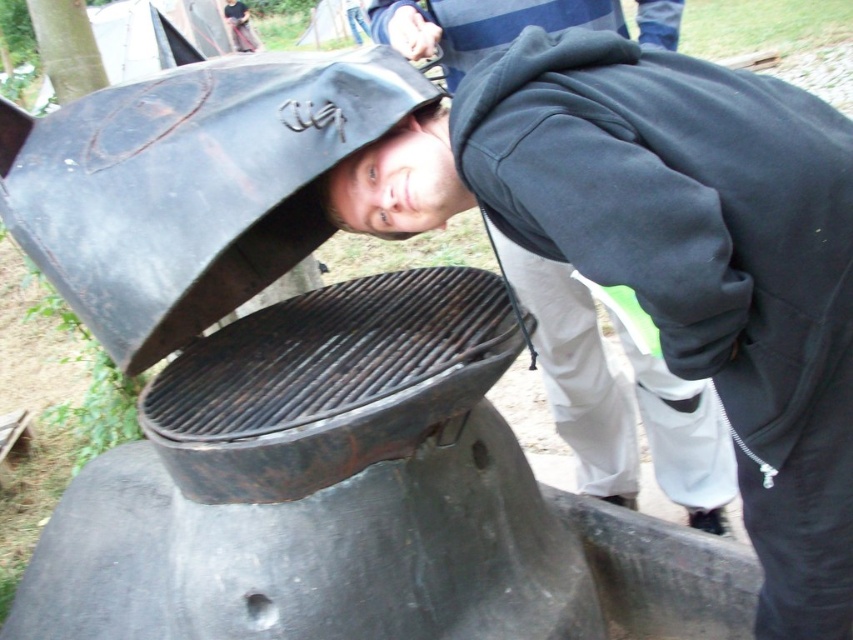
Question: Which point appears closest to the camera in this image?

Choices:
 (A) (177, 456)
 (B) (585, 260)

Answer: (B)

Question: From the image, what is the correct spatial relationship of dark blue fleece at center in relation to rusty metal grill at center?

Choices:
 (A) above
 (B) below

Answer: (A)

Question: Is dark blue fleece at center bigger than rusty metal grill at center?

Choices:
 (A) no
 (B) yes

Answer: (A)

Question: Can you confirm if dark blue fleece at center is thinner than rusty metal grill at center?

Choices:
 (A) yes
 (B) no

Answer: (A)

Question: Among these points, which one is farthest from the camera?

Choices:
 (A) (221, 332)
 (B) (709, 182)

Answer: (A)